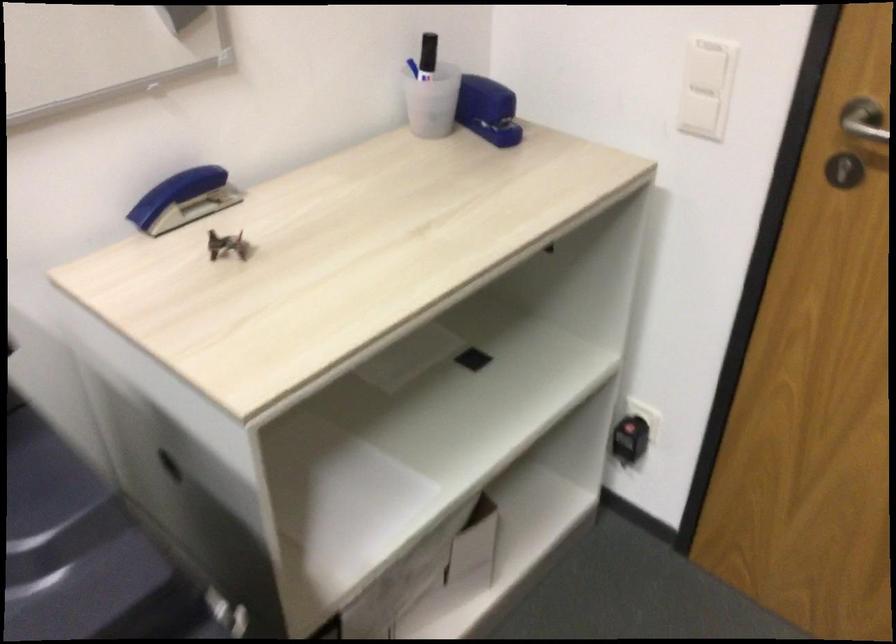
Locate an element on the screen. The image size is (896, 644). door lock is located at coordinates (843, 169).